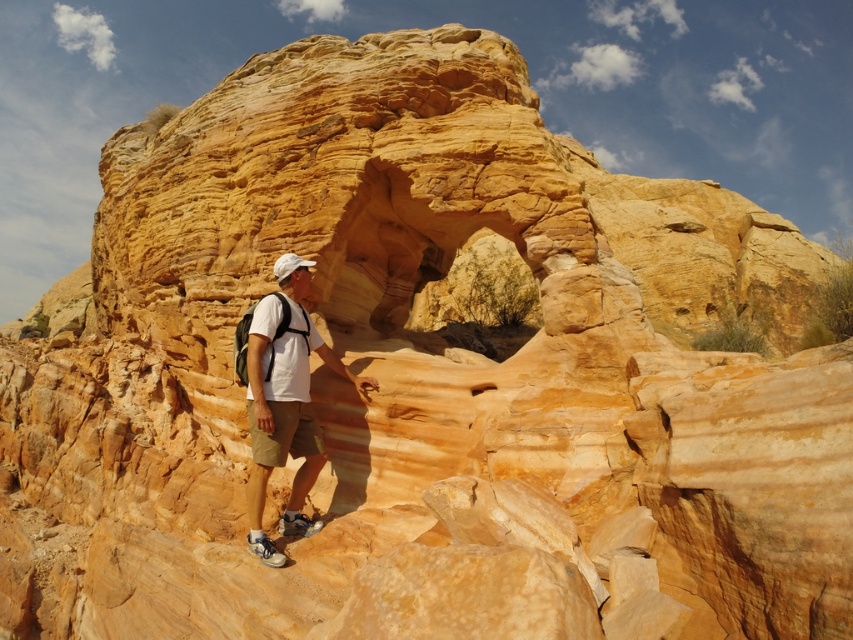
You are a photographer trying to capture the hiker in the image. The camera you are using has a focus point at coordinates 0.639, 0.335. Will the white matte shirt at center be in focus?

The white matte shirt at center is located at point (285, 408), so yes, the white matte shirt at center will be in focus since the focus point matches its location.

You are a photographer trying to capture the hiker in the scene. Since both the white matte shirt at center and the white matte baseball hat at center are in the frame, which one will appear closer to the camera in the photo?

The white matte shirt at center will appear closer to the camera because it is in front of the white matte baseball hat at center.

You are a photographer aiming to capture the hiker in the image. If you want to focus on the white matte baseball hat at center without including the white matte shirt at center in the frame, which direction should you adjust your camera? Please provide a concise answer.

Move the camera to the left to exclude the white matte shirt at center while keeping the white matte baseball hat at center in view.